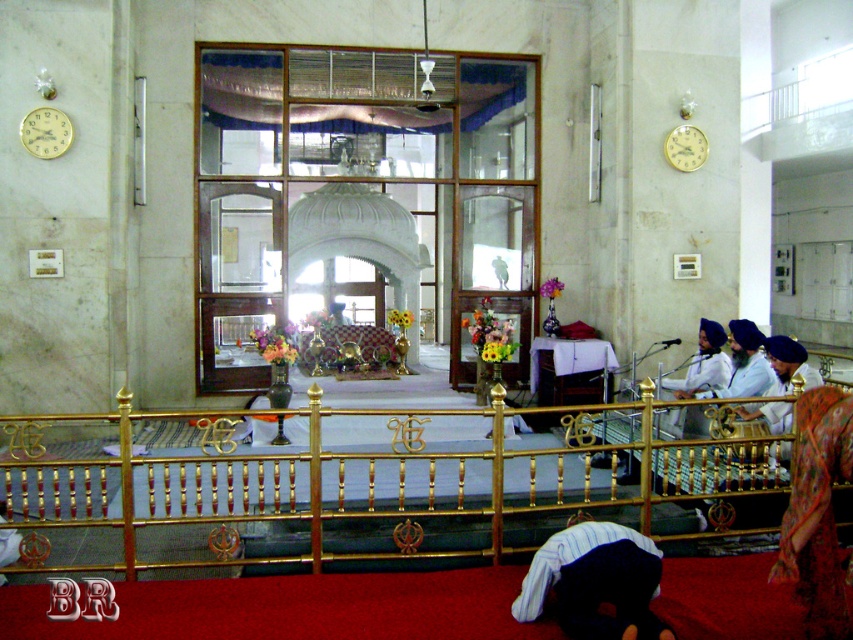
Which is more to the right, gold polished rail at center or floral-patterned fabric at lower right?

floral-patterned fabric at lower right is more to the right.

Does gold polished rail at center appear under floral-patterned fabric at lower right?

Indeed, gold polished rail at center is positioned under floral-patterned fabric at lower right.

Who is more forward, (131, 451) or (838, 477)?

Positioned in front is point (838, 477).

Image resolution: width=853 pixels, height=640 pixels. What are the coordinates of `gold polished rail at center` in the screenshot? It's located at tap(354, 484).

Does gold polished rail at center have a lesser width compared to dark blue turban at lower center?

In fact, gold polished rail at center might be wider than dark blue turban at lower center.

What do you see at coordinates (354, 484) in the screenshot?
I see `gold polished rail at center` at bounding box center [354, 484].

Who is more forward, (80, 417) or (602, 557)?

Point (602, 557) is more forward.

Where is `gold polished rail at center`? The image size is (853, 640). gold polished rail at center is located at coordinates (354, 484).

Does dark blue turban at lower center have a greater width compared to floral-patterned fabric at lower right?

Yes.

Image resolution: width=853 pixels, height=640 pixels. What do you see at coordinates (595, 582) in the screenshot? I see `dark blue turban at lower center` at bounding box center [595, 582].

Locate an element on the screen. The image size is (853, 640). dark blue turban at lower center is located at coordinates (595, 582).